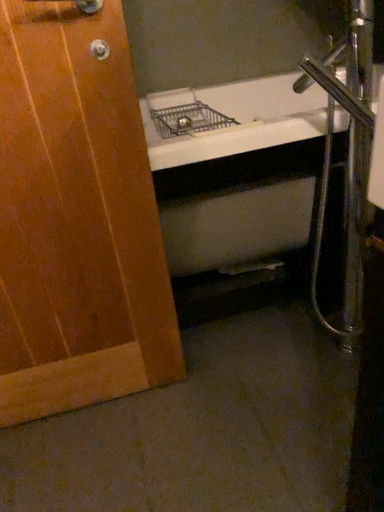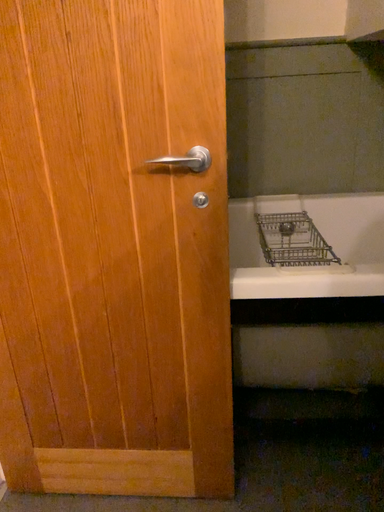
Question: How did the camera likely rotate when shooting the video?

Choices:
 (A) rotated downward
 (B) rotated upward

Answer: (B)